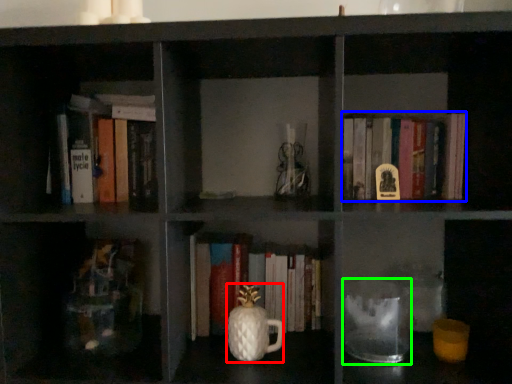
Question: Which is nearer to the glass vase (highlighted by a red box)? book (highlighted by a blue box) or glass jar (highlighted by a green box).

Choices:
 (A) book
 (B) glass jar

Answer: (B)